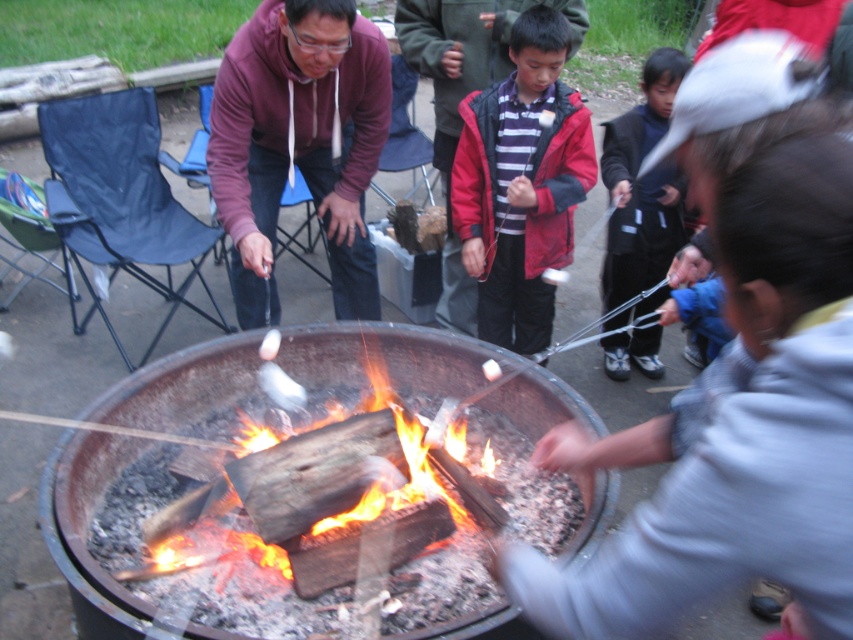
How much distance is there between charcoal fire pit at center and matte purple hoodie at center?

charcoal fire pit at center is 30.56 inches from matte purple hoodie at center.

I want to click on charcoal fire pit at center, so click(x=86, y=529).

Who is more distant from viewer, (271,122) or (701,250)?

The point (271,122) is more distant.

Is matte purple hoodie at center bigger than blue fleece jacket at lower right?

Correct, matte purple hoodie at center is larger in size than blue fleece jacket at lower right.

Is point (334, 179) farther from viewer compared to point (694, 237)?

Yes, point (334, 179) is farther from viewer.

The height and width of the screenshot is (640, 853). I want to click on matte purple hoodie at center, so click(x=299, y=141).

Can you confirm if red matte jacket at center is thinner than dark blue pants at lower right?

No.

Can you confirm if red matte jacket at center is smaller than dark blue pants at lower right?

No.

Where is `red matte jacket at center`? red matte jacket at center is located at coordinates (521, 182).